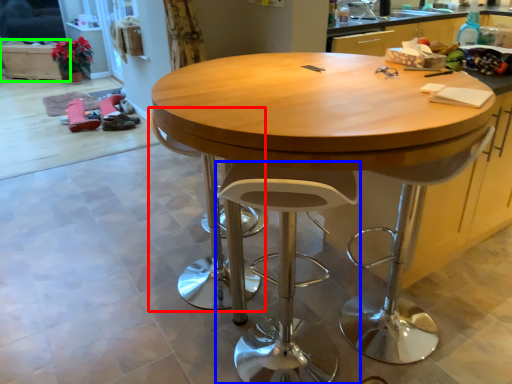
Question: Which is nearer to the swivel chair (highlighted by a red box)? stool (highlighted by a blue box) or cabinetry (highlighted by a green box).

Choices:
 (A) stool
 (B) cabinetry

Answer: (A)